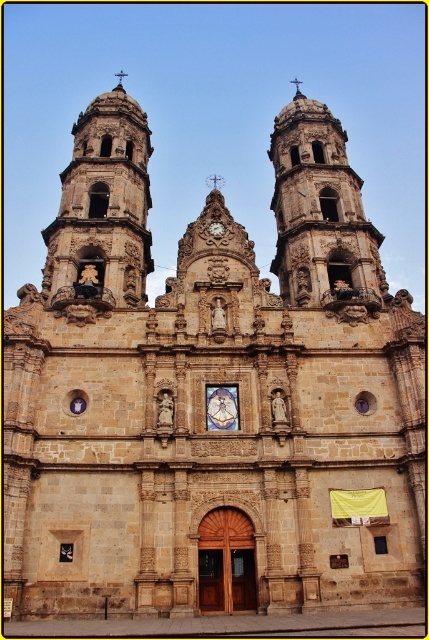
Who is taller, brown stone tower at left or gold ornate clock at center?

brown stone tower at left is taller.

Is brown stone tower at left above gold ornate clock at center?

Indeed, brown stone tower at left is positioned over gold ornate clock at center.

The width and height of the screenshot is (429, 640). I want to click on brown stone tower at left, so click(x=102, y=209).

The image size is (429, 640). Find the location of `brown stone tower at left`. brown stone tower at left is located at coordinates (102, 209).

Can you confirm if brown stone tower at left is taller than stone tower at center?

Yes.

Can you confirm if brown stone tower at left is wider than stone tower at center?

Correct, the width of brown stone tower at left exceeds that of stone tower at center.

Identify the location of brown stone tower at left. The height and width of the screenshot is (640, 429). (102, 209).

Image resolution: width=429 pixels, height=640 pixels. What do you see at coordinates (320, 211) in the screenshot? I see `stone tower at center` at bounding box center [320, 211].

Who is shorter, stone tower at center or gold ornate clock at center?

gold ornate clock at center is shorter.

You are a GUI agent. You are given a task and a screenshot of the screen. Output one action in this format:
    pyautogui.click(x=<x>, y=<y>)
    Task: Click on the stone tower at center
    
    Given the screenshot: What is the action you would take?
    (320, 211)

The height and width of the screenshot is (640, 429). I want to click on stone tower at center, so click(x=320, y=211).